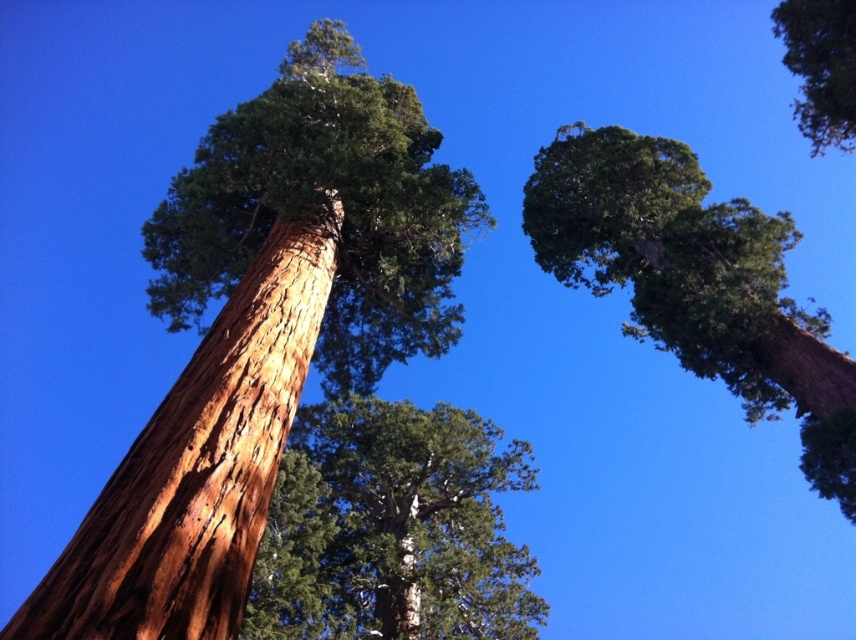
Question: Which of the following is the farthest from the observer?

Choices:
 (A) (788, 330)
 (B) (215, 342)
 (C) (343, 508)
 (D) (825, 17)

Answer: (C)

Question: Is rough brown bark at center above green rough bark tree at center?

Choices:
 (A) yes
 (B) no

Answer: (A)

Question: Which point is closer to the camera?

Choices:
 (A) rough bark tree at center
 (B) green rough bark tree at upper right

Answer: (A)

Question: Can you confirm if rough brown bark at center is bigger than smooth brown tree trunk at upper right?

Choices:
 (A) yes
 (B) no

Answer: (B)

Question: Which point is closer to the camera?

Choices:
 (A) rough bark tree at center
 (B) green rough bark tree at center
 (C) smooth brown tree trunk at upper right

Answer: (A)

Question: Is rough bark tree at center above rough brown bark at center?

Choices:
 (A) yes
 (B) no

Answer: (A)